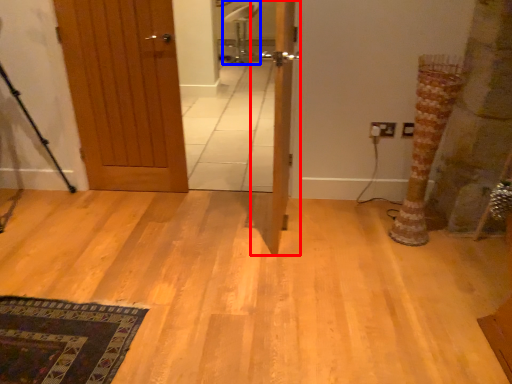
Question: Which object is further to the camera taking this photo, door (highlighted by a red box) or chair (highlighted by a blue box)?

Choices:
 (A) door
 (B) chair

Answer: (B)